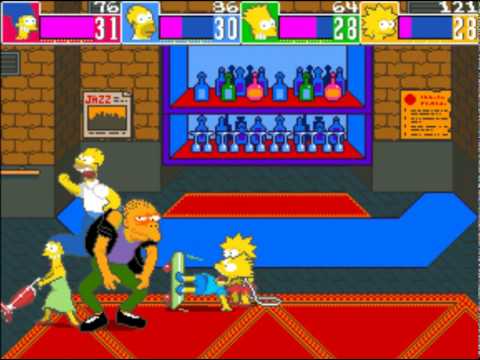
In order to click on red carpet in this screenshot , I will do `click(269, 337)`.